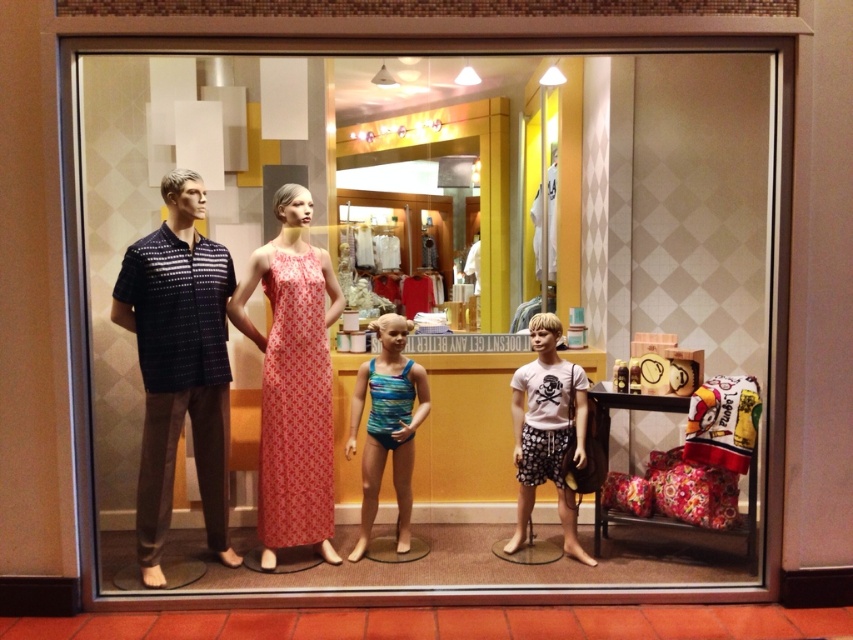
Question: Is matte pink dress at center to the left of white matte t-shirt at center from the viewer's perspective?

Choices:
 (A) yes
 (B) no

Answer: (A)

Question: Is matte black mannequin at left closer to the viewer compared to teal glossy swimsuit at center?

Choices:
 (A) yes
 (B) no

Answer: (A)

Question: Considering the real-world distances, which object is closest to the teal glossy swimsuit at center?

Choices:
 (A) matte black mannequin at left
 (B) white matte t-shirt at center
 (C) matte pink dress at center
 (D) matte dark blue shirt at left

Answer: (C)

Question: From the image, what is the correct spatial relationship of matte dark blue shirt at left in relation to teal glossy swimsuit at center?

Choices:
 (A) above
 (B) below

Answer: (A)

Question: Considering the real-world distances, which object is farthest from the matte black mannequin at left?

Choices:
 (A) teal glossy swimsuit at center
 (B) white matte t-shirt at center

Answer: (B)

Question: Which of the following is the farthest from the observer?

Choices:
 (A) (368, 509)
 (B) (254, 262)
 (C) (190, 336)

Answer: (A)